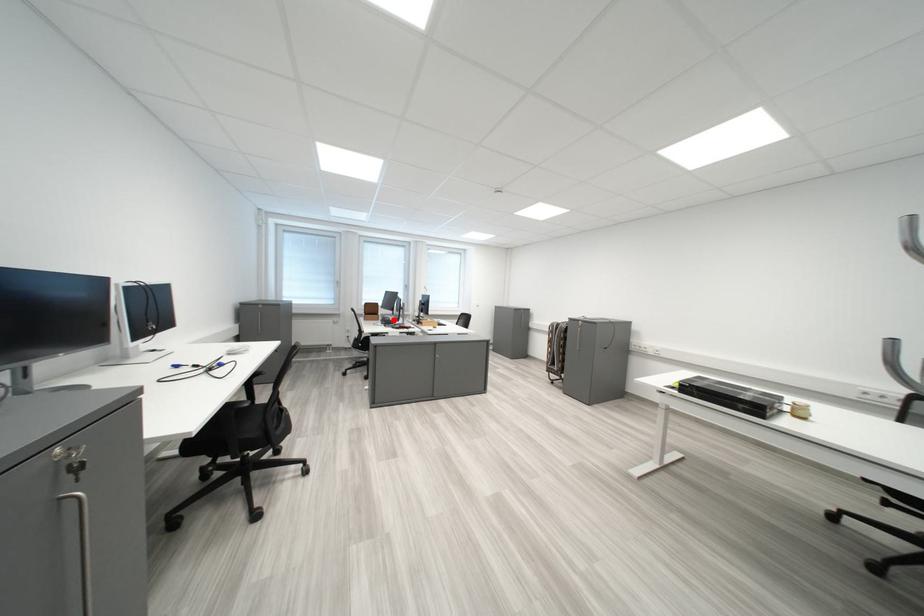
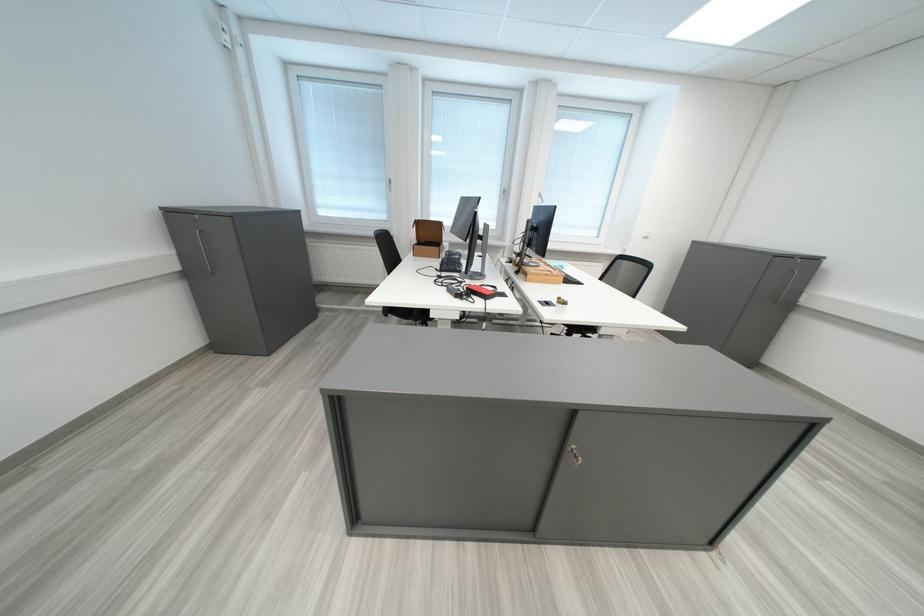
Where in the second image is the point corresponding to the highlighted location from the first image?

(456, 256)